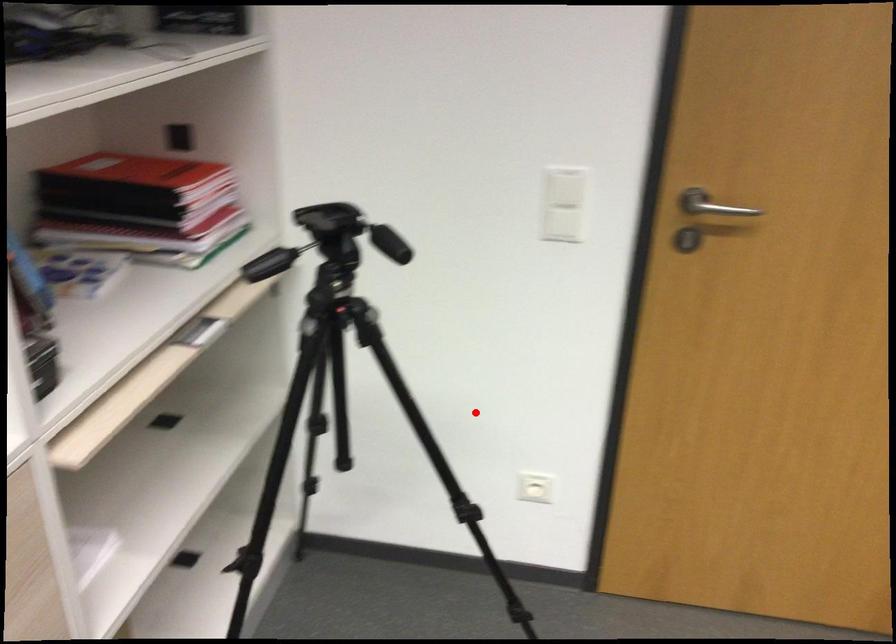
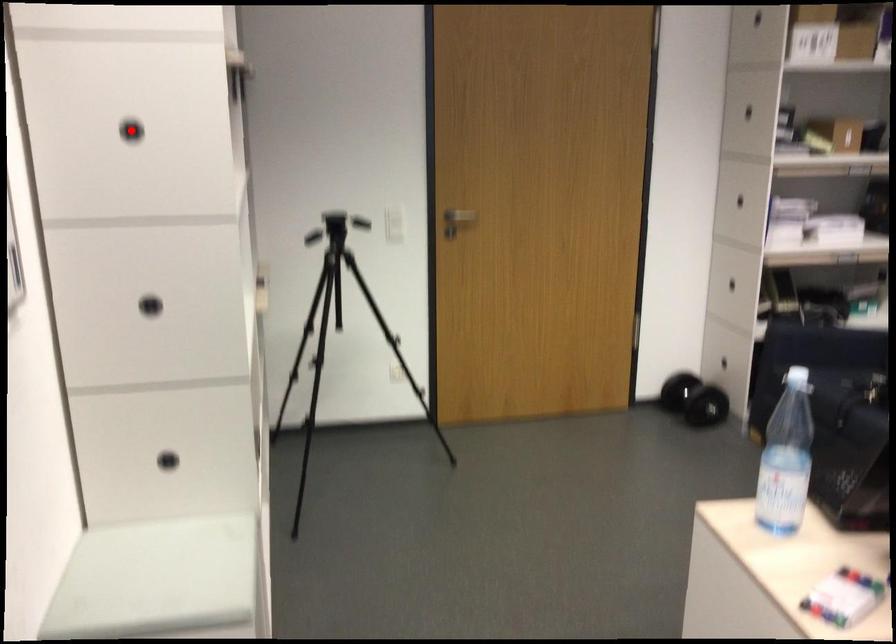
I am providing you with two images of the same scene from different viewpoints. A red point is marked on the first image and another point is marked on the second image. Are the points marked in image1 and image2 representing the same 3D position?

No